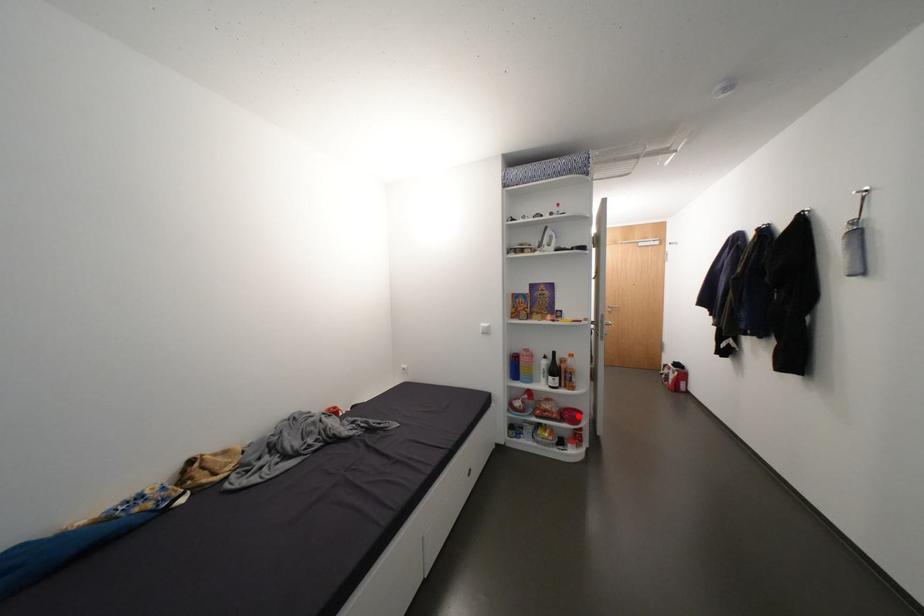
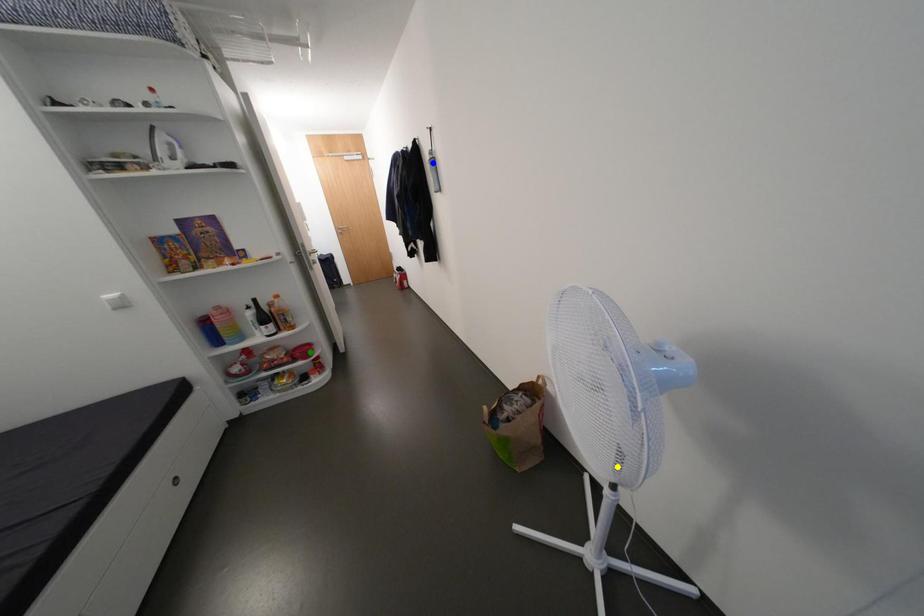
Question: I am providing you with two images of the same scene from different viewpoints. A red point is marked on the first image. You are given multiple points on the second image. Which point in image 2 represents the same 3d spot as the red point in image 1?

Choices:
 (A) yellow point
 (B) green point
 (C) blue point

Answer: (B)